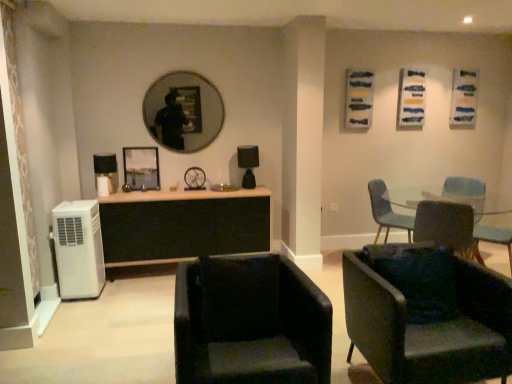
Question: From the image's perspective, is teal fabric chair at center right, the first chair when ordered from back to front, located above or below black leather chair at lower center, placed as the fourth chair when sorted from back to front?

Choices:
 (A) above
 (B) below

Answer: (A)

Question: Considering the positions of teal fabric chair at center right, the first chair when ordered from back to front, and black leather chair at lower center, placed as the fourth chair when sorted from back to front, in the image, is teal fabric chair at center right, the first chair when ordered from back to front, bigger or smaller than black leather chair at lower center, placed as the fourth chair when sorted from back to front,?

Choices:
 (A) small
 (B) big

Answer: (A)

Question: Based on their relative distances, which object is farther from the black leather chair at lower center, which ranks as the first chair in front-to-back order?

Choices:
 (A) velvet green armchair at lower right, which is the 2th chair in front-to-back order
 (B) metallic silver picture frame at center
 (C) matte black lamp at center
 (D) matte black chair at lower right, which is counted as the second chair, starting from the back
 (E) black wood cabinet at center

Answer: (B)

Question: Which of these objects is positioned farthest from the matte black chair at lower right, the third chair when ordered from front to back?

Choices:
 (A) black leather chair at lower center, which ranks as the first chair in front-to-back order
 (B) teal fabric chair at center right, the first chair when ordered from back to front
 (C) black wood cabinet at center
 (D) matte black mirror at upper center
 (E) white plastic air conditioner at lower left

Answer: (E)